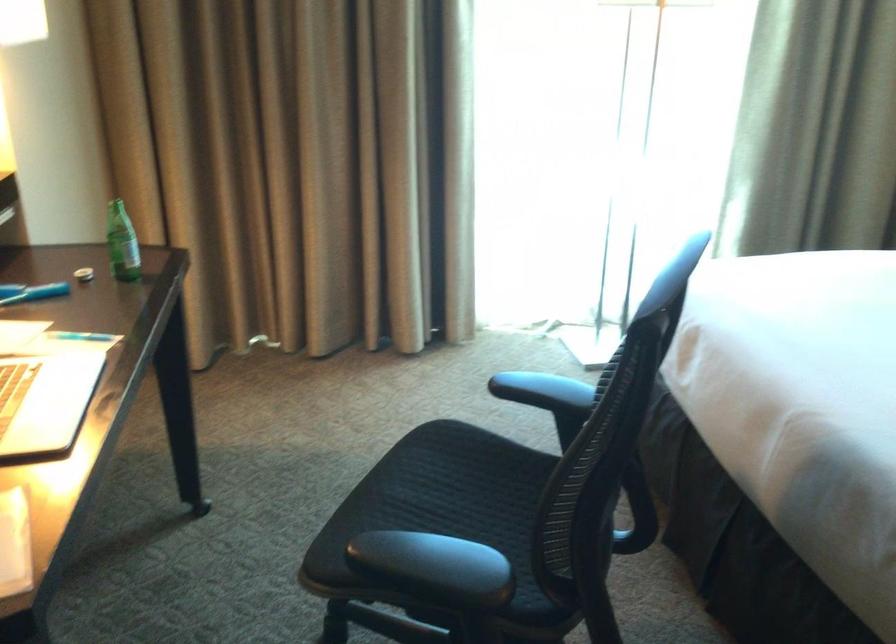
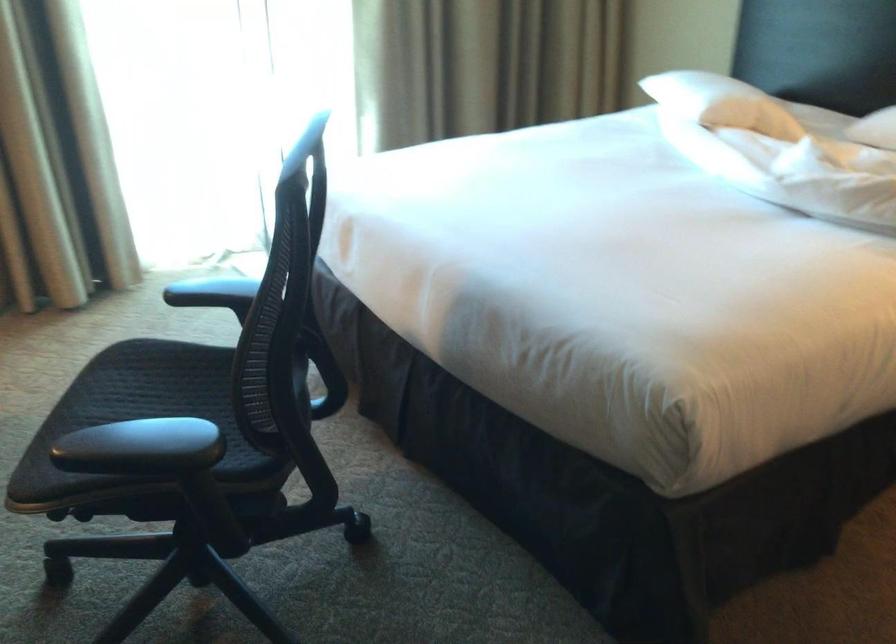
Find the pixel in the second image that matches the point at 429,570 in the first image.

(142, 448)